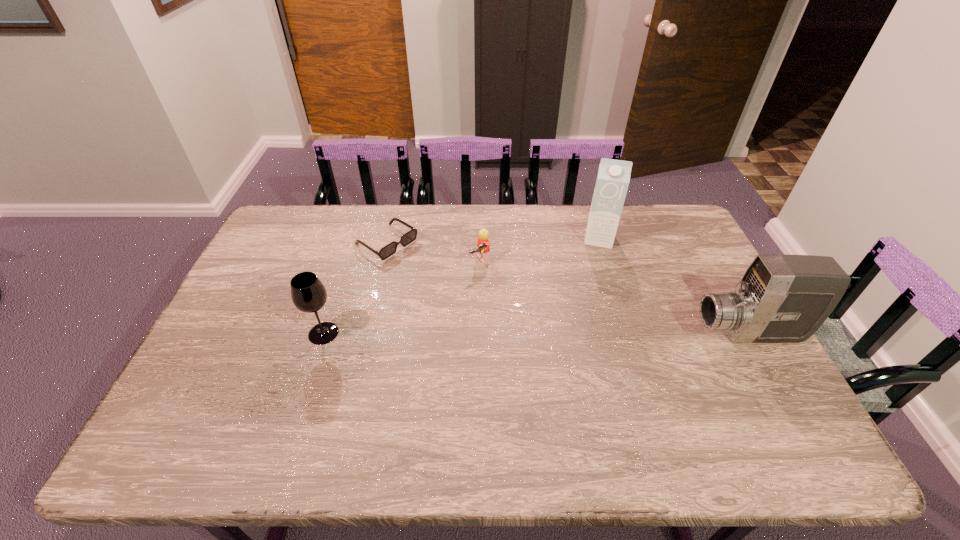
Locate an element on the screen. unoccupied area between the sunglasses and the third shortest object is located at coordinates (355, 288).

You are a GUI agent. You are given a task and a screenshot of the screen. Output one action in this format:
    pyautogui.click(x=<x>, y=<y>)
    Task: Click on the vacant space that's between the rightmost object and the sunglasses
    
    Given the screenshot: What is the action you would take?
    pyautogui.click(x=567, y=288)

You are a GUI agent. You are given a task and a screenshot of the screen. Output one action in this format:
    pyautogui.click(x=<x>, y=<y>)
    Task: Click on the free spot between the third tallest object and the shortest object
    
    Given the screenshot: What is the action you would take?
    pyautogui.click(x=355, y=288)

Locate an element on the screen. free space between the rightmost object and the third object from right to left is located at coordinates 613,298.

The image size is (960, 540). Find the location of `vacant space in between the rightmost object and the fourth object from left to right`. vacant space in between the rightmost object and the fourth object from left to right is located at coordinates (673, 286).

Identify the location of vacant point located between the third shortest object and the shortest object. (355, 288).

Image resolution: width=960 pixels, height=540 pixels. What are the coordinates of `empty space between the sunglasses and the carton` in the screenshot? It's located at (492, 241).

The width and height of the screenshot is (960, 540). Identify the location of free space between the third object from right to left and the sunglasses. (433, 252).

You are a GUI agent. You are given a task and a screenshot of the screen. Output one action in this format:
    pyautogui.click(x=<x>, y=<y>)
    Task: Click on the free space between the wineglass and the third object from left to right
    Image resolution: width=960 pixels, height=540 pixels.
    Given the screenshot: What is the action you would take?
    pyautogui.click(x=401, y=298)

Identify the location of free space that is in between the camcorder and the second shortest object. (613, 298).